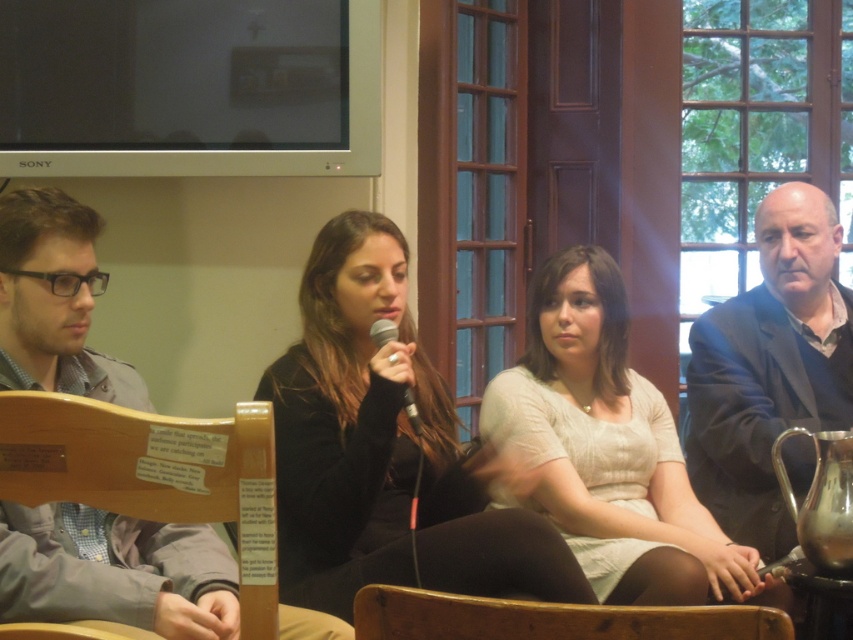
Which is below, black velvet jacket at center or light beige knit sweater at center?

black velvet jacket at center is lower down.

Is black velvet jacket at center bigger than light beige knit sweater at center?

Indeed, black velvet jacket at center has a larger size compared to light beige knit sweater at center.

Between point (334, 372) and point (666, 440), which one is positioned in front?

Point (334, 372) is in front.

This screenshot has width=853, height=640. I want to click on black velvet jacket at center, so click(x=386, y=451).

Between light beige knit sweater at center and wooden chair at lower left, which one is positioned lower?

light beige knit sweater at center is below.

This screenshot has width=853, height=640. In order to click on light beige knit sweater at center in this screenshot , I will do `click(607, 448)`.

Is black velvet jacket at center taller than wooden chair at lower left?

Yes, black velvet jacket at center is taller than wooden chair at lower left.

Is point (328, 339) positioned in front of point (251, 616)?

No, it is behind (251, 616).

This screenshot has width=853, height=640. I want to click on black velvet jacket at center, so click(386, 451).